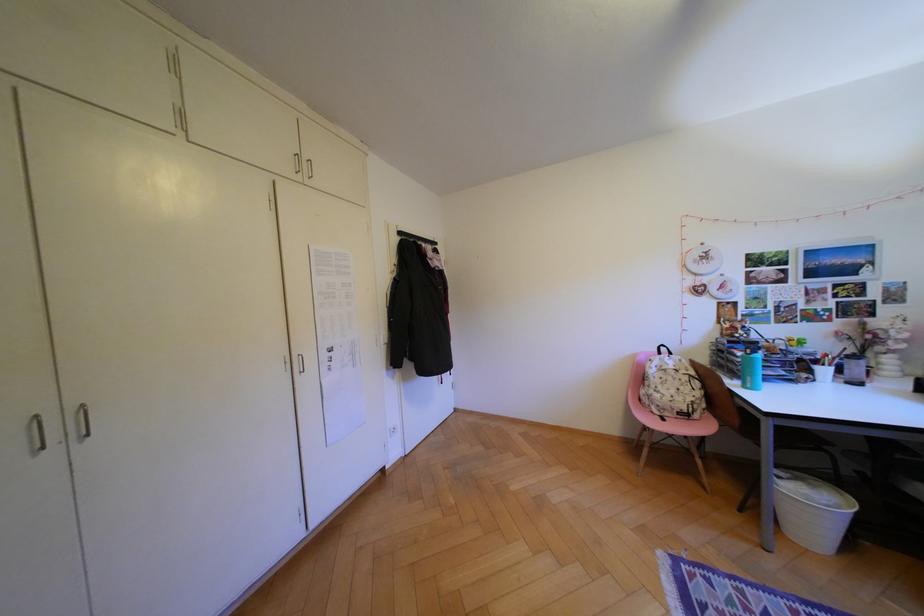
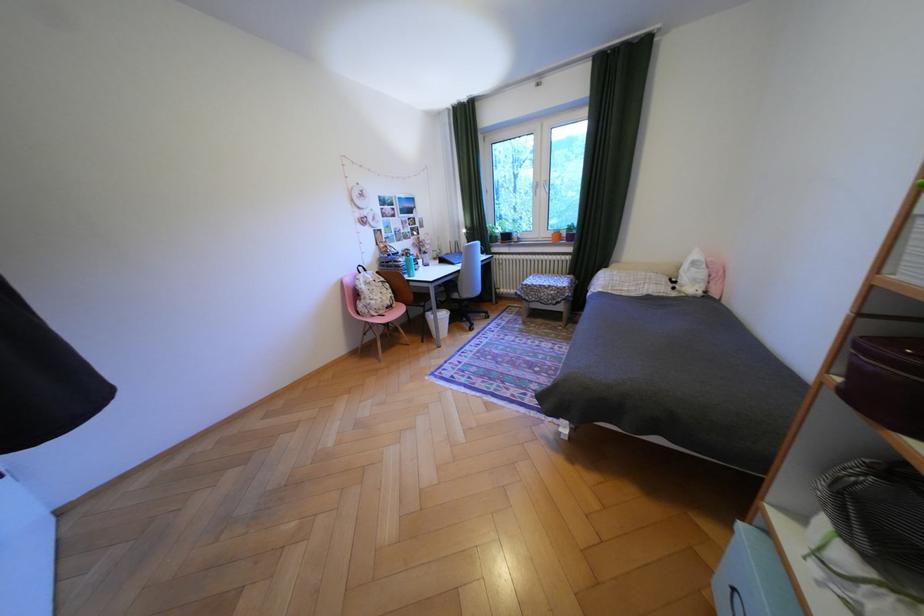
Locate, in the second image, the point that corresponds to point 678,414 in the first image.

(393, 312)